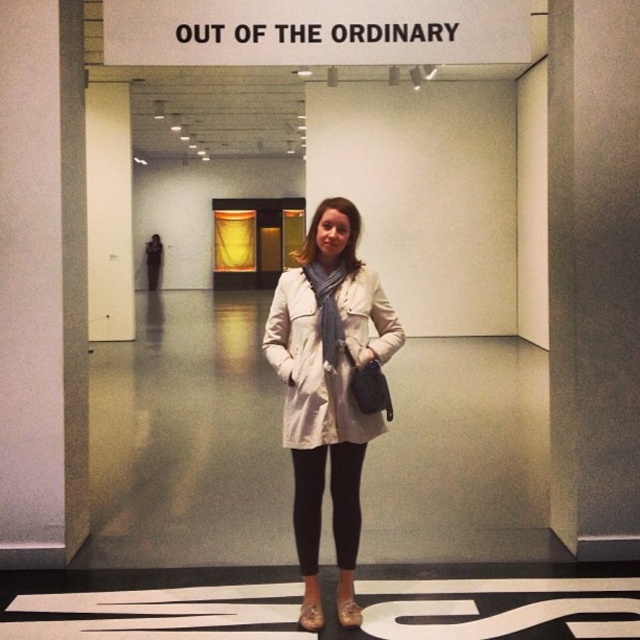
Question: Which object is closer to the camera taking this photo?

Choices:
 (A) black leggings at center
 (B) matte white coat at center

Answer: (B)

Question: Based on their relative distances, which object is nearer to the matte white coat at center?

Choices:
 (A) black leggings at center
 (B) beige fabric coat at center

Answer: (B)

Question: Does beige fabric coat at center appear on the left side of matte white coat at center?

Choices:
 (A) yes
 (B) no

Answer: (B)

Question: Can you confirm if beige fabric coat at center is positioned above matte white coat at center?

Choices:
 (A) yes
 (B) no

Answer: (B)

Question: Does beige fabric coat at center appear over black leggings at center?

Choices:
 (A) no
 (B) yes

Answer: (B)

Question: Which object is the closest to the black leggings at center?

Choices:
 (A) matte white coat at center
 (B) beige fabric coat at center

Answer: (B)